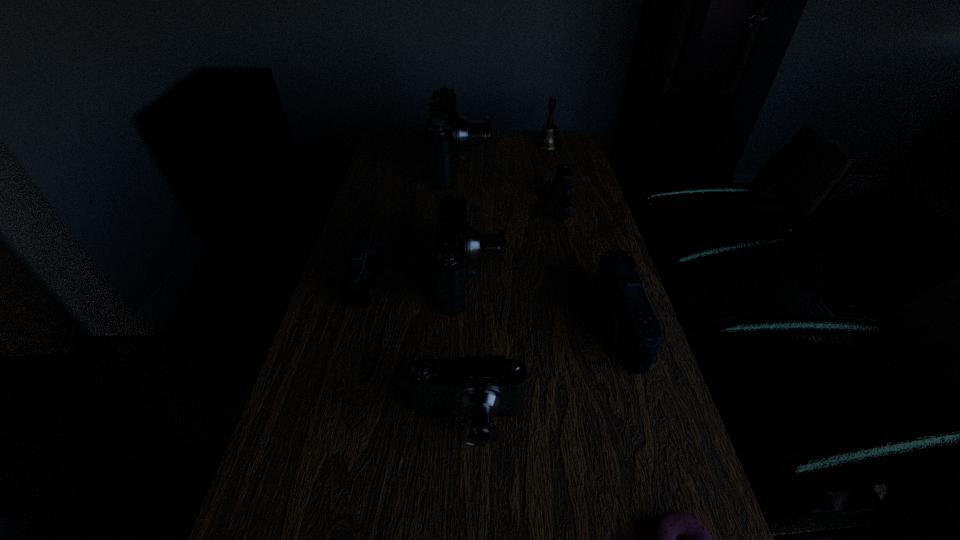
At what (x,y) coordinates should I click in order to perform the action: click on object that ranks as the closest to the leftmost object. Please return your answer as a coordinate pair (x, y). Looking at the image, I should click on (456, 244).

Image resolution: width=960 pixels, height=540 pixels. Find the location of `object that stands as the seventh closest to the rightmost camcorder`. object that stands as the seventh closest to the rightmost camcorder is located at coordinates (548, 140).

Where is `camcorder that stands as the third closest to the doughnut`? The height and width of the screenshot is (540, 960). camcorder that stands as the third closest to the doughnut is located at coordinates (456, 244).

Where is `camcorder that is the third closest one to the pink doughnut`? This screenshot has width=960, height=540. camcorder that is the third closest one to the pink doughnut is located at coordinates (456, 244).

Locate which blue camcorder ranks in proximity to the rightmost camcorder. Please provide its 2D coordinates. Your answer should be formatted as a tuple, i.e. [(x, y)], where the tuple contains the x and y coordinates of a point satisfying the conditions above.

[(479, 389)]

You are a GUI agent. You are given a task and a screenshot of the screen. Output one action in this format:
    pyautogui.click(x=<x>, y=<y>)
    Task: Click on the blue camcorder that is the closest to the nearest camcorder
    This screenshot has width=960, height=540.
    Given the screenshot: What is the action you would take?
    pyautogui.click(x=456, y=244)